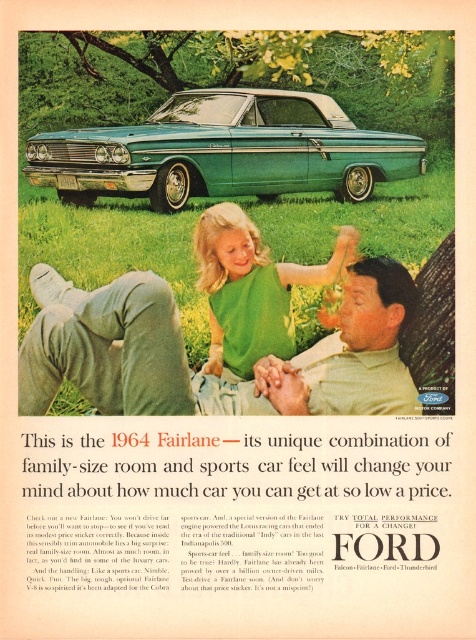
In the vintage Ford Fairlane advertisement, there are two green fabric items depicted. The first is green fabric pants at lower left and the second is green fabric shirt at center. Which of these two items is larger in size?

The green fabric pants at lower left is bigger than green fabric shirt at center.

In the vintage Ford Fairlane ad, you see two people wearing green fabric pants at lower left and green fabric shirt at center. Which clothing item is shorter in height?

The green fabric pants at lower left is not as tall as the green fabric shirt at center, so the pants are shorter in height.